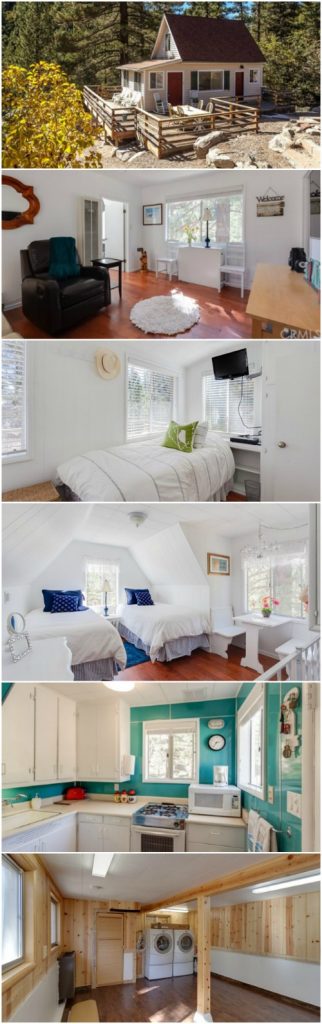
Where is `stove plates`? stove plates is located at coordinates (167, 812), (173, 806), (152, 807), (147, 810).